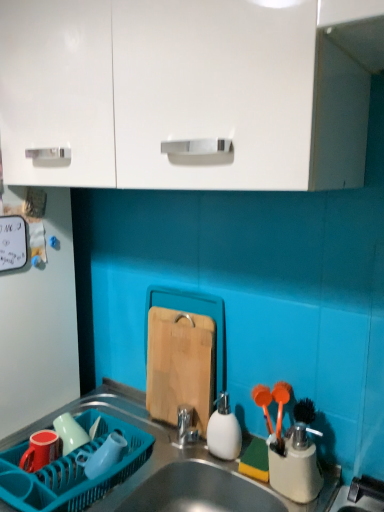
You are a GUI agent. You are given a task and a screenshot of the screen. Output one action in this format:
    pyautogui.click(x=<x>, y=<y>)
    Task: Click on the teal plastic dish rack at lower left
    
    Given the screenshot: What is the action you would take?
    pyautogui.click(x=71, y=470)

What is the approximate height of matte green cup at left, which is the third tableware in right-to-left order?

matte green cup at left, which is the third tableware in right-to-left order, is 3.15 inches tall.

Where is `translucent blue plastic cup at lower left, arranged as the 2th tableware when viewed from the right`? The width and height of the screenshot is (384, 512). translucent blue plastic cup at lower left, arranged as the 2th tableware when viewed from the right is located at coordinates (103, 456).

What do you see at coordinates (103, 456) in the screenshot? The width and height of the screenshot is (384, 512). I see `translucent blue plastic cup at lower left, arranged as the 2th tableware when viewed from the right` at bounding box center [103, 456].

How much space does white matte soap dispenser at center, the first tableware when ordered from right to left, occupy vertically?

white matte soap dispenser at center, the first tableware when ordered from right to left, is 7.21 inches tall.

What is the approximate width of wooden cutting board at center?

wooden cutting board at center is 0.93 inches wide.

What do you see at coordinates (189, 92) in the screenshot? The height and width of the screenshot is (512, 384). I see `white glossy cabinet at upper center` at bounding box center [189, 92].

At what (x,y) coordinates should I click in order to perform the action: click on teal plastic dish rack at lower left. Please return your answer as a coordinate pair (x, y). The image size is (384, 512). Looking at the image, I should click on coord(71,470).

Is matte green cup at left, which is the third tableware in right-to-left order, placed right next to white matte soap dispenser at center, the first tableware when ordered from right to left?

matte green cup at left, which is the third tableware in right-to-left order, and white matte soap dispenser at center, the first tableware when ordered from right to left, are not in contact.

Which object is further away from the camera taking this photo, matte green cup at left, which is the third tableware in right-to-left order, or white matte soap dispenser at center, the first tableware when ordered from right to left?

matte green cup at left, which is the third tableware in right-to-left order, is more distant.

From the image's perspective, would you say matte green cup at left, which is the second tableware from left to right, is shown under white matte soap dispenser at center, which is the 4th tableware from left to right?

Yes.

From the picture: From the image's perspective, does translucent blue plastic cup at lower left, positioned as the third tableware in left-to-right order, appear lower than white glossy cabinet at upper center?

Yes, from the image's perspective, translucent blue plastic cup at lower left, positioned as the third tableware in left-to-right order, is beneath white glossy cabinet at upper center.

Between point (92, 478) and point (10, 21), which one is positioned in front?

Positioned in front is point (10, 21).

Is translucent blue plastic cup at lower left, arranged as the 2th tableware when viewed from the right, oriented towards white glossy cabinet at upper center?

No, translucent blue plastic cup at lower left, arranged as the 2th tableware when viewed from the right, is not turned towards white glossy cabinet at upper center.

Is translucent blue plastic cup at lower left, arranged as the 2th tableware when viewed from the right, taller or shorter than white glossy cabinet at upper center?

translucent blue plastic cup at lower left, arranged as the 2th tableware when viewed from the right, is shorter than white glossy cabinet at upper center.

Measure the distance from teal plastic dish rack at lower left to matte ceramic mug at lower left, the 4th tableware positioned from the right.

teal plastic dish rack at lower left and matte ceramic mug at lower left, the 4th tableware positioned from the right, are 4.13 inches apart from each other.

The image size is (384, 512). What are the coordinates of `basket in front of the matte ceramic mug at lower left, the 1th tableware from the left` in the screenshot? It's located at (71, 470).

Considering the positions of objects teal plastic dish rack at lower left and matte ceramic mug at lower left, the 4th tableware positioned from the right, in the image provided, who is more to the right, teal plastic dish rack at lower left or matte ceramic mug at lower left, the 4th tableware positioned from the right,?

Positioned to the right is teal plastic dish rack at lower left.

What's the angular difference between teal plastic dish rack at lower left and matte ceramic mug at lower left, the 1th tableware from the left,'s facing directions?

They differ by 0.336 degrees in their facing directions.

Can you confirm if wooden cutting board at center is shorter than white glossy cabinet at upper center?

Indeed, wooden cutting board at center has a lesser height compared to white glossy cabinet at upper center.

Considering the sizes of objects wooden cutting board at center and white glossy cabinet at upper center in the image provided, who is wider, wooden cutting board at center or white glossy cabinet at upper center?

Wider between the two is white glossy cabinet at upper center.

How distant is wooden cutting board at center from white glossy cabinet at upper center?

A distance of 23.81 inches exists between wooden cutting board at center and white glossy cabinet at upper center.

Does point (149, 390) appear closer or farther from the camera than point (248, 76)?

Point (149, 390) appears to be farther away from the viewer than point (248, 76).

From the image's perspective, between translucent blue plastic cup at lower left, arranged as the 2th tableware when viewed from the right, and white matte soap dispenser at center, the first tableware when ordered from right to left, which one is located above?

white matte soap dispenser at center, the first tableware when ordered from right to left, from the image's perspective.

Would you say translucent blue plastic cup at lower left, arranged as the 2th tableware when viewed from the right, is outside white matte soap dispenser at center, which is the 4th tableware from left to right?

Yes, translucent blue plastic cup at lower left, arranged as the 2th tableware when viewed from the right, is located beyond the bounds of white matte soap dispenser at center, which is the 4th tableware from left to right.

Could you measure the distance between translucent blue plastic cup at lower left, arranged as the 2th tableware when viewed from the right, and white matte soap dispenser at center, the first tableware when ordered from right to left?

translucent blue plastic cup at lower left, arranged as the 2th tableware when viewed from the right, and white matte soap dispenser at center, the first tableware when ordered from right to left, are 10.89 inches apart.

From a real-world perspective, who is located higher, translucent blue plastic cup at lower left, positioned as the third tableware in left-to-right order, or white matte soap dispenser at center, the first tableware when ordered from right to left?

white matte soap dispenser at center, the first tableware when ordered from right to left, from a real-world perspective.

Measure the distance between matte green cup at left, which is the third tableware in right-to-left order, and matte ceramic mug at lower left, the 1th tableware from the left.

They are 2.15 inches apart.

Does matte green cup at left, which is the second tableware from left to right, appear on the left side of matte ceramic mug at lower left, the 4th tableware positioned from the right?

Incorrect, matte green cup at left, which is the second tableware from left to right, is not on the left side of matte ceramic mug at lower left, the 4th tableware positioned from the right.

Does matte green cup at left, which is the third tableware in right-to-left order, have a lesser height compared to matte ceramic mug at lower left, the 1th tableware from the left?

No.

Is matte green cup at left, which is the third tableware in right-to-left order, facing towards matte ceramic mug at lower left, the 4th tableware positioned from the right?

Yes, matte green cup at left, which is the third tableware in right-to-left order, is turned towards matte ceramic mug at lower left, the 4th tableware positioned from the right.

Can you confirm if wooden cutting board at center is bigger than matte ceramic mug at lower left, the 4th tableware positioned from the right?

Yes.

At what (x,y) coordinates should I click in order to perform the action: click on cutting board above the matte ceramic mug at lower left, the 1th tableware from the left (from the image's perspective). Please return your answer as a coordinate pair (x, y). The height and width of the screenshot is (512, 384). Looking at the image, I should click on (180, 365).

Which is correct: wooden cutting board at center is inside matte ceramic mug at lower left, the 4th tableware positioned from the right, or outside of it?

wooden cutting board at center is spatially situated outside matte ceramic mug at lower left, the 4th tableware positioned from the right.

Image resolution: width=384 pixels, height=512 pixels. Identify the location of tableware that is the 2nd one when counting forward from the matte green cup at left, which is the second tableware from left to right. coord(224,430).

From the image's perspective, count 3rd tablewares downward from the white glossy cabinet at upper center and point to it. Please provide its 2D coordinates.

[(103, 456)]

Which object lies nearer to the anchor point matte ceramic mug at lower left, the 1th tableware from the left, white matte soap dispenser at center, the first tableware when ordered from right to left, or wooden cutting board at center?

wooden cutting board at center is positioned closer to the anchor matte ceramic mug at lower left, the 1th tableware from the left.

From the image, which object appears to be farther from translucent blue plastic cup at lower left, arranged as the 2th tableware when viewed from the right, matte ceramic mug at lower left, the 4th tableware positioned from the right, or teal plastic dish rack at lower left?

matte ceramic mug at lower left, the 4th tableware positioned from the right, lies further to translucent blue plastic cup at lower left, arranged as the 2th tableware when viewed from the right, than the other object.

Considering their positions, is matte green cup at left, which is the second tableware from left to right, positioned closer to metallic stainless steel sink at lower center than white glossy cabinet at upper center?

matte green cup at left, which is the second tableware from left to right, lies closer to metallic stainless steel sink at lower center than the other object.

Based on the photo, considering their positions, is matte green cup at left, which is the third tableware in right-to-left order, positioned further to wooden cutting board at center than white glossy cabinet at upper center?

white glossy cabinet at upper center.

When comparing their distances from translucent blue plastic cup at lower left, positioned as the third tableware in left-to-right order, does teal plastic dish rack at lower left or metallic stainless steel sink at lower center seem further?

metallic stainless steel sink at lower center.

Considering their positions, is white glossy cabinet at upper center positioned further to translucent blue plastic cup at lower left, positioned as the third tableware in left-to-right order, than teal plastic dish rack at lower left?

white glossy cabinet at upper center.

In the scene shown: Which object lies further to the anchor point white matte soap dispenser at center, the first tableware when ordered from right to left, metallic stainless steel sink at lower center or teal plastic dish rack at lower left?

The object further to white matte soap dispenser at center, the first tableware when ordered from right to left, is teal plastic dish rack at lower left.

Which object lies further to the anchor point white matte soap dispenser at center, the first tableware when ordered from right to left, matte ceramic mug at lower left, the 1th tableware from the left, or metallic stainless steel sink at lower center?

Among the two, matte ceramic mug at lower left, the 1th tableware from the left, is located further to white matte soap dispenser at center, the first tableware when ordered from right to left.

Locate an element on the screen. basket between metallic stainless steel sink at lower center and wooden cutting board at center from front to back is located at coordinates (71, 470).

Locate an element on the screen. cutting board located between translucent blue plastic cup at lower left, positioned as the third tableware in left-to-right order, and white matte soap dispenser at center, the first tableware when ordered from right to left, in the left-right direction is located at coordinates (180, 365).

The height and width of the screenshot is (512, 384). In order to click on cutting board between white glossy cabinet at upper center and white matte soap dispenser at center, which is the 4th tableware from left to right, from top to bottom in this screenshot , I will do `click(180, 365)`.

The image size is (384, 512). In order to click on cutting board between white glossy cabinet at upper center and metallic stainless steel sink at lower center in the up-down direction in this screenshot , I will do `click(180, 365)`.